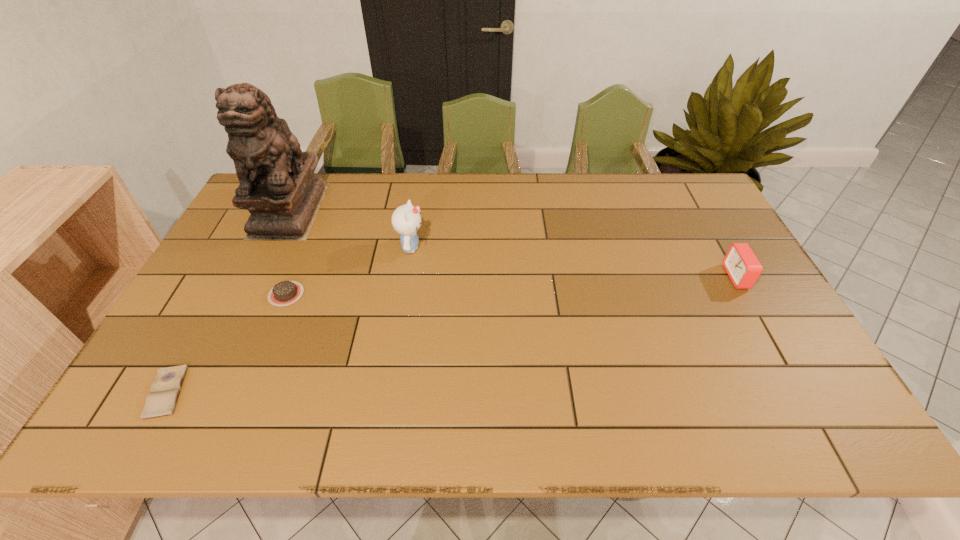
I want to click on free spot between the chocolate cake and the fourth object from left to right, so click(x=348, y=271).

The image size is (960, 540). In order to click on vacant point located between the sculpture and the third tallest object in this screenshot , I will do `click(514, 244)`.

The width and height of the screenshot is (960, 540). Find the location of `free space between the sculpture and the chocolate cake`. free space between the sculpture and the chocolate cake is located at coordinates (288, 252).

Find the location of `empty space between the fourth tallest object and the alarm clock`. empty space between the fourth tallest object and the alarm clock is located at coordinates (512, 286).

Find the location of a particular element. vacant area between the nearest object and the fourth object from left to right is located at coordinates (289, 320).

Where is `free space between the nearest object and the chocolate cake`? The width and height of the screenshot is (960, 540). free space between the nearest object and the chocolate cake is located at coordinates (227, 343).

Locate an element on the screen. The height and width of the screenshot is (540, 960). free spot between the second shortest object and the second tallest object is located at coordinates (348, 271).

Select which object appears as the third closest to the chocolate cake. Please provide its 2D coordinates. Your answer should be formatted as a tuple, i.e. [(x, y)], where the tuple contains the x and y coordinates of a point satisfying the conditions above.

[(406, 219)]

Identify the location of the second closest object to the sculpture. (406, 219).

The height and width of the screenshot is (540, 960). What are the coordinates of `vacant area in the image that satisfies the following two spatial constraints: 1. on the front-facing side of the sculpture; 2. on the right side of the chocolate cake` in the screenshot? It's located at (249, 294).